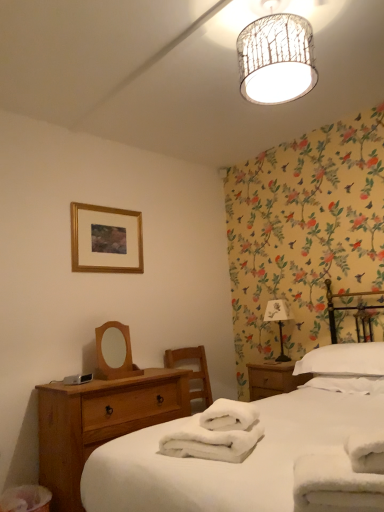
Question: Should I look upward or downward to see white soft towel at right, which appears as the third bath towel when viewed from the left?

Choices:
 (A) up
 (B) down

Answer: (B)

Question: Does white soft pillow at right have a larger size compared to white fluffy bath towel at center, marked as the second bath towel in a back-to-front arrangement?

Choices:
 (A) yes
 (B) no

Answer: (A)

Question: Can you confirm if white soft pillow at right is taller than white fluffy bath towel at center, positioned as the 2th bath towel in front-to-back order?

Choices:
 (A) yes
 (B) no

Answer: (A)

Question: Is white fluffy bath towel at center, the 1th bath towel viewed from the left, a part of white soft pillow at right?

Choices:
 (A) no
 (B) yes

Answer: (A)

Question: Is white soft pillow at right beside white fluffy bath towel at center, marked as the second bath towel in a back-to-front arrangement?

Choices:
 (A) yes
 (B) no

Answer: (B)

Question: From the image's perspective, is white soft pillow at right beneath white fluffy bath towel at center, positioned as the 2th bath towel in front-to-back order?

Choices:
 (A) yes
 (B) no

Answer: (A)

Question: Does white soft pillow at right have a greater width compared to white fluffy bath towel at center, the 1th bath towel viewed from the left?

Choices:
 (A) yes
 (B) no

Answer: (A)

Question: Is white fluffy bath towel at center, the third bath towel when ordered from right to left, wider than light brown wood at lower left?

Choices:
 (A) no
 (B) yes

Answer: (A)

Question: Is white fluffy bath towel at center, the third bath towel when ordered from right to left, not inside light brown wood at lower left?

Choices:
 (A) yes
 (B) no

Answer: (A)

Question: Is white fluffy bath towel at center, positioned as the 2th bath towel in front-to-back order, at the right side of light brown wood at lower left?

Choices:
 (A) no
 (B) yes

Answer: (B)

Question: From a real-world perspective, is white fluffy bath towel at center, marked as the second bath towel in a back-to-front arrangement, on light brown wood at lower left?

Choices:
 (A) no
 (B) yes

Answer: (B)

Question: Does white fluffy bath towel at center, the third bath towel when ordered from right to left, appear on the left side of light brown wood at lower left?

Choices:
 (A) no
 (B) yes

Answer: (A)

Question: Is the position of white fluffy bath towel at center, marked as the second bath towel in a back-to-front arrangement, less distant than that of light brown wood at lower left?

Choices:
 (A) no
 (B) yes

Answer: (B)

Question: Is white soft pillow at right located within white cotton bed at left?

Choices:
 (A) yes
 (B) no

Answer: (A)